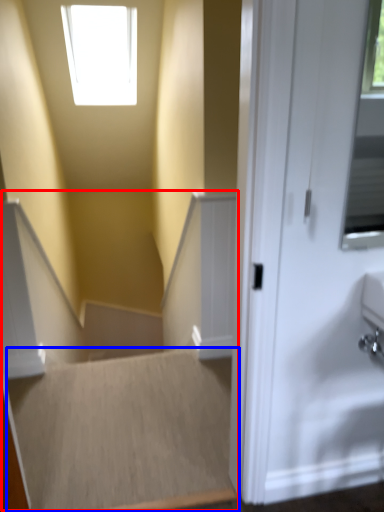
Question: Which object appears farthest to the camera in this image, stairwell (highlighted by a red box) or stairwell (highlighted by a blue box)?

Choices:
 (A) stairwell
 (B) stairwell

Answer: (B)